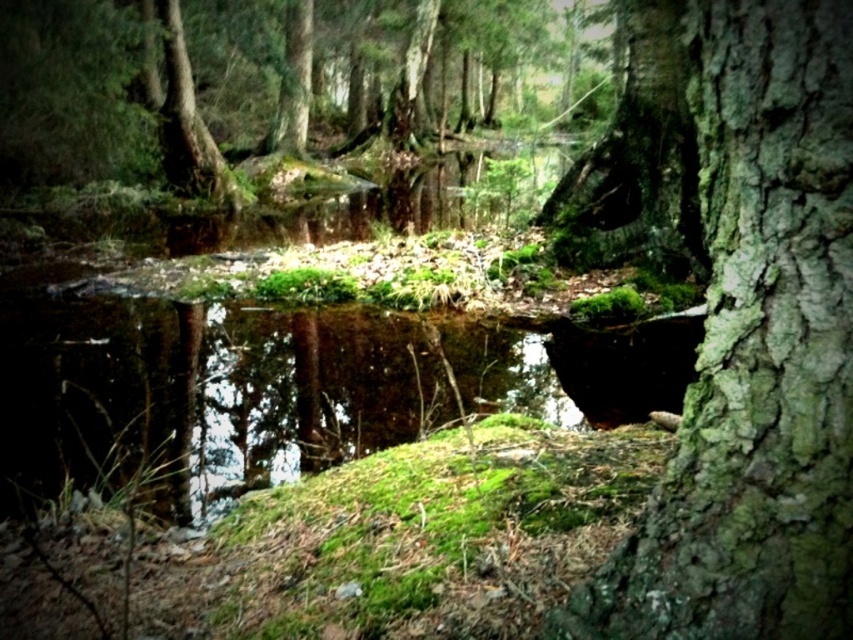
You are a hiker trying to navigate through the forest. You notice two tree trunks in your path. The first is the green rough bark tree trunk at center, and the second is the green mossy bark tree trunk at upper left. Which tree trunk is wider?

The green mossy bark tree trunk at upper left is wider than the green rough bark tree trunk at center.

You are a hiker standing at the edge of the pond and want to take a photo of both the green rough bark tree trunk at center and the green mossy bark tree trunk at upper left. Which tree trunk should you focus on first if you want to capture both in your camera frame?

You should focus on the green rough bark tree trunk at center first because it is shorter than the green mossy bark tree trunk at upper left, allowing you to frame both by adjusting your angle to include the taller trunk in the background.